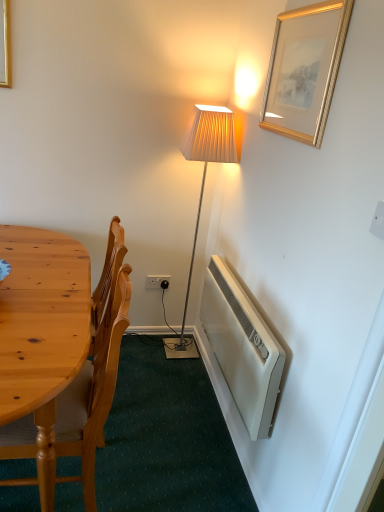
Question: Is white plastic radiator at lower right outside gold/gilded picture frame at upper right?

Choices:
 (A) no
 (B) yes

Answer: (B)

Question: Can gold/gilded picture frame at upper right be found inside white plastic radiator at lower right?

Choices:
 (A) yes
 (B) no

Answer: (B)

Question: Can you confirm if white plastic radiator at lower right is bigger than gold/gilded picture frame at upper right?

Choices:
 (A) no
 (B) yes

Answer: (B)

Question: From a real-world perspective, does white plastic radiator at lower right sit lower than gold/gilded picture frame at upper right?

Choices:
 (A) no
 (B) yes

Answer: (B)

Question: Is white plastic radiator at lower right placed right next to gold/gilded picture frame at upper right?

Choices:
 (A) yes
 (B) no

Answer: (B)

Question: From the image's perspective, is white plastic radiator at lower right positioned above or below white plastic power outlet at lower center?

Choices:
 (A) above
 (B) below

Answer: (B)

Question: From a real-world perspective, is white plastic radiator at lower right positioned above or below white plastic power outlet at lower center?

Choices:
 (A) above
 (B) below

Answer: (A)

Question: Would you say white plastic radiator at lower right is inside or outside white plastic power outlet at lower center?

Choices:
 (A) outside
 (B) inside

Answer: (A)

Question: In terms of width, does white plastic radiator at lower right look wider or thinner when compared to white plastic power outlet at lower center?

Choices:
 (A) thin
 (B) wide

Answer: (B)

Question: From a real-world perspective, is white plastic power outlet at lower center above or below gold/gilded picture frame at upper right?

Choices:
 (A) below
 (B) above

Answer: (A)

Question: From the image's perspective, relative to gold/gilded picture frame at upper right, is white plastic power outlet at lower center above or below?

Choices:
 (A) above
 (B) below

Answer: (B)

Question: From their relative heights in the image, would you say white plastic power outlet at lower center is taller or shorter than gold/gilded picture frame at upper right?

Choices:
 (A) short
 (B) tall

Answer: (A)

Question: Considering the positions of white plastic power outlet at lower center and gold/gilded picture frame at upper right in the image, is white plastic power outlet at lower center bigger or smaller than gold/gilded picture frame at upper right?

Choices:
 (A) small
 (B) big

Answer: (A)

Question: From their relative heights in the image, would you say white plastic power outlet at lower center is taller or shorter than wooden chair at left?

Choices:
 (A) tall
 (B) short

Answer: (B)

Question: From the image's perspective, is white plastic power outlet at lower center positioned above or below wooden chair at left?

Choices:
 (A) above
 (B) below

Answer: (A)